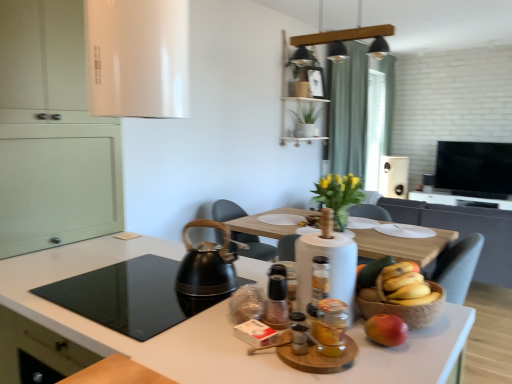
What do you see at coordinates (372, 271) in the screenshot? The image size is (512, 384). I see `yellow matte bananas at center` at bounding box center [372, 271].

Locate an element on the screen. yellow matte bananas at center is located at coordinates (372, 271).

Locate an element on the screen. white plastic toaster at upper right, the first appliance in the back-to-front sequence is located at coordinates (393, 176).

What is the approximate width of white plastic toaster at upper right, which is the 1th appliance in top-to-bottom order?

It is 17.12 inches.

What do you see at coordinates (386, 330) in the screenshot? This screenshot has height=384, width=512. I see `red matte apple at lower right` at bounding box center [386, 330].

Describe the element at coordinates (398, 270) in the screenshot. The height and width of the screenshot is (384, 512). I see `yellow matte bananas at center, which is the second banana in front-to-back order` at that location.

In order to click on translucent glass jar at center, positioned as the first bottle in front-to-back order in this screenshot , I will do `click(330, 327)`.

At what (x,y) coordinates should I click in order to perform the action: click on yellow matte bananas at center. Please return your answer as a coordinate pair (x, y). Looking at the image, I should click on (372, 271).

Measure the distance from black glass cooktop at lower left to matte green cabinet at left.

28.89 inches.

In the image, is black glass cooktop at lower left positioned in front of or behind matte green cabinet at left?

black glass cooktop at lower left is positioned closer to the viewer than matte green cabinet at left.

From a real-world perspective, relative to matte green cabinet at left, is black glass cooktop at lower left vertically above or below?

In terms of real-world spatial position, black glass cooktop at lower left is below matte green cabinet at left.

In the image, is black glass cooktop at lower left on the left side or the right side of matte green cabinet at left?

From the image, it's evident that black glass cooktop at lower left is to the right of matte green cabinet at left.

Is yellow matte bananas at center, the first banana when ordered from front to back, not within matte white vase at center?

Yes, yellow matte bananas at center, the first banana when ordered from front to back, is outside of matte white vase at center.

Which is in front, point (407, 279) or point (334, 212)?

The point (407, 279) is more forward.

Starting from the matte white vase at center, which banana is the 2nd one to the left? Please provide its 2D coordinates.

[(404, 285)]

Is the depth of yellow matte bananas at center, arranged as the 2th banana when viewed from the back, less than that of matte white vase at center?

Yes, yellow matte bananas at center, arranged as the 2th banana when viewed from the back, is closer to the camera.

Considering the sizes of white paper towel holder at center, which is counted as the 2th appliance, starting from the right, and matte white vase at center in the image, is white paper towel holder at center, which is counted as the 2th appliance, starting from the right, wider or thinner than matte white vase at center?

In the image, white paper towel holder at center, which is counted as the 2th appliance, starting from the right, appears to be wider than matte white vase at center.

From a real-world perspective, is white paper towel holder at center, which is counted as the 2th appliance, starting from the back, physically below matte white vase at center?

No.

From the image's perspective, which one is positioned lower, white paper towel holder at center, which appears as the first appliance when viewed from the left, or matte white vase at center?

white paper towel holder at center, which appears as the first appliance when viewed from the left, is shown below in the image.

Is white paper towel holder at center, which appears as the first appliance when viewed from the left, bigger than matte white vase at center?

Yes.

Is point (325, 283) closer or farther from the camera than point (210, 242)?

Point (325, 283).

Is translucent glass jar at center, the 2th bottle positioned from the front, inside or outside of black matte tea kettle at center?

translucent glass jar at center, the 2th bottle positioned from the front, is located beyond the bounds of black matte tea kettle at center.

Looking at this image, are translucent glass jar at center, the 2th bottle when ordered from back to front, and black matte tea kettle at center far apart?

No, translucent glass jar at center, the 2th bottle when ordered from back to front, is not far away from black matte tea kettle at center.

From the picture: Considering the relative sizes of matte white vase at center and translucent glass bottle at center, positioned as the 3th bottle in front-to-back order, in the image provided, is matte white vase at center taller than translucent glass bottle at center, positioned as the 3th bottle in front-to-back order,?

In fact, matte white vase at center may be shorter than translucent glass bottle at center, positioned as the 3th bottle in front-to-back order.

Does matte white vase at center turn towards translucent glass bottle at center, positioned as the 3th bottle in front-to-back order?

Yes, matte white vase at center is oriented towards translucent glass bottle at center, positioned as the 3th bottle in front-to-back order.

Considering the positions of objects matte white vase at center and translucent glass bottle at center, positioned as the 3th bottle in front-to-back order, in the image provided, who is behind, matte white vase at center or translucent glass bottle at center, positioned as the 3th bottle in front-to-back order,?

matte white vase at center is behind.

Which object is wider, matte white vase at center or translucent glass bottle at center, positioned as the 3th bottle in front-to-back order?

matte white vase at center is wider.

Which is nearer, (330, 171) or (205, 247)?

Clearly, point (330, 171) is more distant from the camera than point (205, 247).

Is green fabric curtain at upper center in front of or behind black matte tea kettle at center in the image?

green fabric curtain at upper center is positioned farther from the viewer than black matte tea kettle at center.

From a real-world perspective, is green fabric curtain at upper center physically above black matte tea kettle at center?

Yes, from a real-world perspective, green fabric curtain at upper center is on top of black matte tea kettle at center.

Can you see green fabric curtain at upper center touching black matte tea kettle at center?

No, green fabric curtain at upper center is not with black matte tea kettle at center.

Based on the photo, who is shorter, yellow matte bananas at center or green fabric curtain at upper center?

With less height is yellow matte bananas at center.

Locate an element on the screen. The height and width of the screenshot is (384, 512). fruit in front of the green fabric curtain at upper center is located at coordinates (372, 271).

Does point (373, 273) lie behind point (366, 97)?

No.

From the picture: From a real-world perspective, between yellow matte bananas at center and green fabric curtain at upper center, who is vertically lower?

yellow matte bananas at center.

Identify the location of cabinetry on the left of black glass cooktop at lower left. This screenshot has height=384, width=512. 52,133.

The height and width of the screenshot is (384, 512). What are the coordinates of `banana that is the 2nd one when counting forward from the matte white vase at center` in the screenshot? It's located at (404, 285).

When comparing their distances from translucent glass jar at center, positioned as the first bottle in front-to-back order, does matte white vase at center or white glossy countertop at lower left seem further?

matte white vase at center lies further to translucent glass jar at center, positioned as the first bottle in front-to-back order, than the other object.

Which object lies nearer to the anchor point translucent glass jar at center, positioned as the first bottle in front-to-back order, translucent glass bottle at center, positioned as the 3th bottle in front-to-back order, or red matte apple at lower right?

red matte apple at lower right.

Estimate the real-world distances between objects in this image. Which object is closer to white paper towel holder at center, which appears as the first appliance when viewed from the left, yellow matte bananas at center, the first banana when ordered from front to back, or red matte apple at lower right?

red matte apple at lower right.

Which object lies nearer to the anchor point matte white vase at center, black matte tea kettle at center or matte green cabinet at left?

Among the two, black matte tea kettle at center is located nearer to matte white vase at center.

From the image, which object appears to be farther from white paper towel holder at center, acting as the first appliance starting from the bottom, translucent glass jar at center, the 2th bottle positioned from the front, or black glass cooktop at lower left?

black glass cooktop at lower left is further to white paper towel holder at center, acting as the first appliance starting from the bottom.

In the scene shown: Based on their spatial positions, is matte green cabinet at left or yellow matte bananas at center further from red matte apple at lower right?

The object further to red matte apple at lower right is matte green cabinet at left.

Looking at the image, which one is located closer to matte green cabinet at left, yellow matte bananas at center, which is the second banana in front-to-back order, or black glass cooktop at lower left?

Among the two, black glass cooktop at lower left is located nearer to matte green cabinet at left.

Based on their spatial positions, is translucent glass jar at center, the 2th bottle when ordered from back to front, or black glass cooktop at lower left closer to white glossy countertop at lower left?

The object closer to white glossy countertop at lower left is black glass cooktop at lower left.

The width and height of the screenshot is (512, 384). I want to click on tea pot between translucent glass bottle at center, positioned as the 3th bottle in front-to-back order, and white plastic toaster at upper right, the second appliance viewed from the front, along the z-axis, so click(207, 264).

You are a GUI agent. You are given a task and a screenshot of the screen. Output one action in this format:
    pyautogui.click(x=<x>, y=<y>)
    Task: Click on the tea pot between black glass cooktop at lower left and yellow matte bananas at center in the horizontal direction
    This screenshot has height=384, width=512.
    Given the screenshot: What is the action you would take?
    pyautogui.click(x=207, y=264)

The height and width of the screenshot is (384, 512). I want to click on appliance situated between translucent glass jar at center, the third bottle positioned from the back, and red matte apple at lower right from left to right, so click(328, 262).

At what (x,y) coordinates should I click in order to perform the action: click on banana between yellow matte bananas at center and matte white vase at center from front to back. Please return your answer as a coordinate pair (x, y). Image resolution: width=512 pixels, height=384 pixels. Looking at the image, I should click on (398, 270).